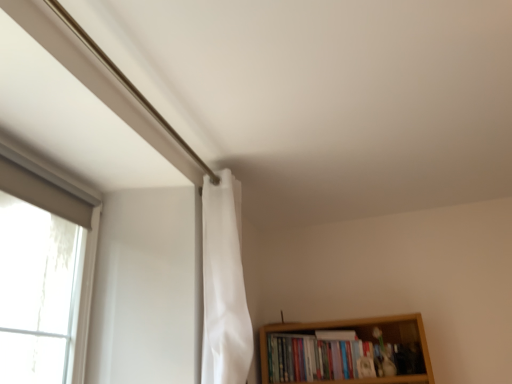
Question: Is hardcover books at lower right thinner than white fabric shower curtain at upper center?

Choices:
 (A) no
 (B) yes

Answer: (A)

Question: From the image's perspective, is hardcover books at lower right below white fabric shower curtain at upper center?

Choices:
 (A) yes
 (B) no

Answer: (A)

Question: Considering the relative sizes of hardcover books at lower right and white fabric shower curtain at upper center in the image provided, is hardcover books at lower right smaller than white fabric shower curtain at upper center?

Choices:
 (A) yes
 (B) no

Answer: (B)

Question: Is hardcover books at lower right facing away from white fabric shower curtain at upper center?

Choices:
 (A) no
 (B) yes

Answer: (A)

Question: From a real-world perspective, is hardcover books at lower right physically below white fabric shower curtain at upper center?

Choices:
 (A) no
 (B) yes

Answer: (B)

Question: Considering the relative sizes of hardcover books at lower right and white fabric shower curtain at upper center in the image provided, is hardcover books at lower right bigger than white fabric shower curtain at upper center?

Choices:
 (A) no
 (B) yes

Answer: (B)

Question: Is white fabric shower curtain at upper center far away from hardcover books at lower right?

Choices:
 (A) no
 (B) yes

Answer: (A)

Question: Can you confirm if white fabric shower curtain at upper center is bigger than hardcover books at lower right?

Choices:
 (A) no
 (B) yes

Answer: (A)

Question: From a real-world perspective, is white fabric shower curtain at upper center on hardcover books at lower right?

Choices:
 (A) no
 (B) yes

Answer: (B)

Question: Is hardcover books at lower right a part of white fabric shower curtain at upper center?

Choices:
 (A) no
 (B) yes

Answer: (A)

Question: Considering the relative sizes of white fabric shower curtain at upper center and hardcover books at lower right in the image provided, is white fabric shower curtain at upper center smaller than hardcover books at lower right?

Choices:
 (A) no
 (B) yes

Answer: (B)

Question: Considering the relative sizes of white fabric shower curtain at upper center and hardcover books at lower right in the image provided, is white fabric shower curtain at upper center shorter than hardcover books at lower right?

Choices:
 (A) yes
 (B) no

Answer: (B)

Question: Is hardcover books at lower right taller or shorter than white fabric shower curtain at upper center?

Choices:
 (A) tall
 (B) short

Answer: (B)